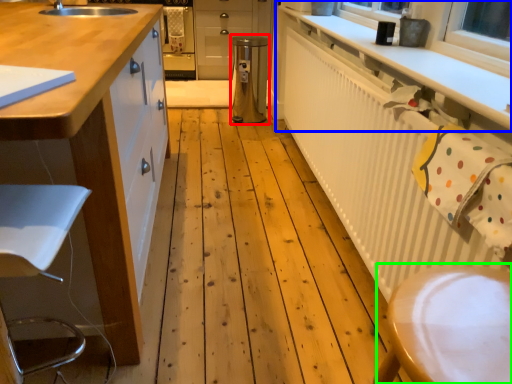
Question: Estimate the real-world distances between objects in this image. Which object is farther from appliance (highlighted by a red box), countertop (highlighted by a blue box) or step stool (highlighted by a green box)?

Choices:
 (A) countertop
 (B) step stool

Answer: (B)